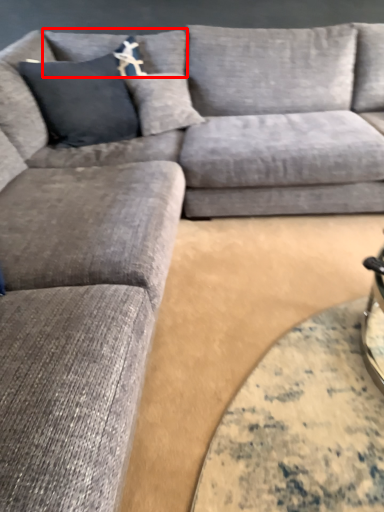
Question: Observing the image, what is the correct spatial positioning of pillow (annotated by the red box) in reference to couch?

Choices:
 (A) left
 (B) right

Answer: (A)